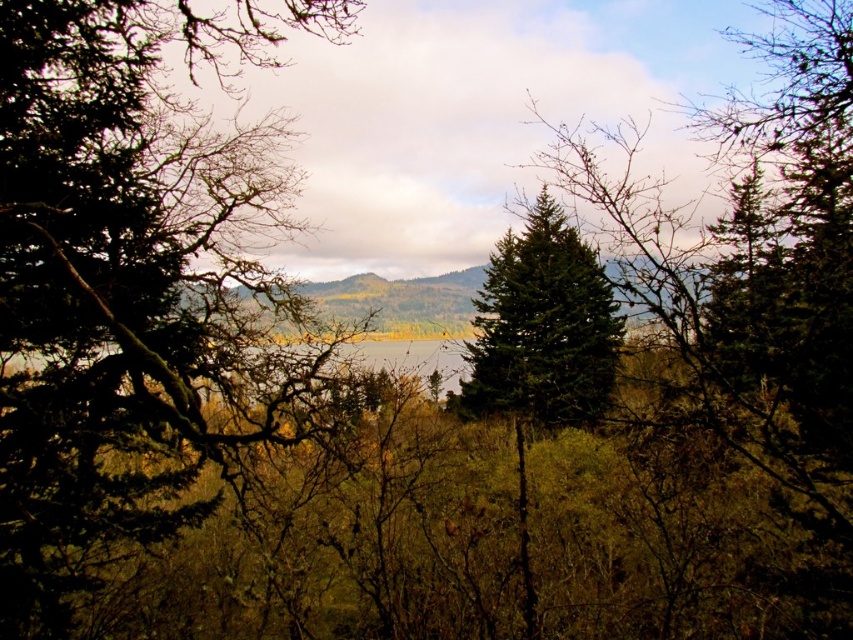
Question: Among these points, which one is nearest to the camera?

Choices:
 (A) (553, 355)
 (B) (196, 460)

Answer: (B)

Question: Is green matte tree at left below green matte pine at center?

Choices:
 (A) no
 (B) yes

Answer: (A)

Question: Which object is closer to the camera taking this photo?

Choices:
 (A) green matte tree at left
 (B) green matte forest at center
 (C) green matte pine at center

Answer: (C)

Question: Based on their relative distances, which object is nearer to the green matte forest at center?

Choices:
 (A) green matte tree at left
 (B) green matte pine at center

Answer: (A)

Question: Does green matte tree at left have a lesser width compared to green matte forest at center?

Choices:
 (A) yes
 (B) no

Answer: (A)

Question: Can you confirm if green matte pine at center is wider than green matte forest at center?

Choices:
 (A) no
 (B) yes

Answer: (B)